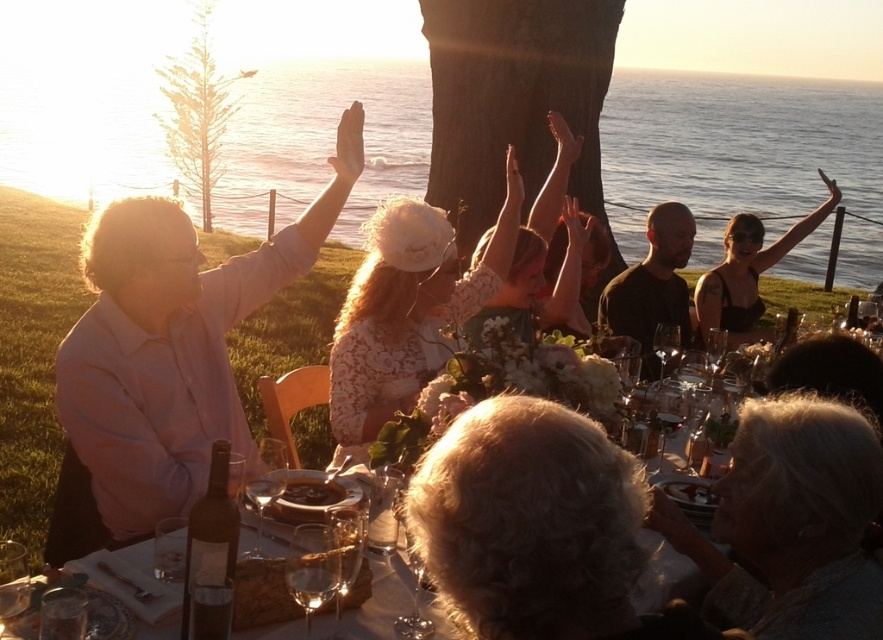
Find the location of `white lace dress at center`. white lace dress at center is located at coordinates (406, 310).

Which is in front, point (357, 380) or point (731, 316)?

Point (357, 380) is in front.

This screenshot has width=883, height=640. I want to click on white lace dress at center, so click(406, 310).

Can you confirm if green leafy tree at upper left is positioned below dark brown wooden plate at center?

Actually, green leafy tree at upper left is above dark brown wooden plate at center.

Can you confirm if green leafy tree at upper left is thinner than dark brown wooden plate at center?

In fact, green leafy tree at upper left might be wider than dark brown wooden plate at center.

Image resolution: width=883 pixels, height=640 pixels. What do you see at coordinates (197, 108) in the screenshot? I see `green leafy tree at upper left` at bounding box center [197, 108].

Where is `green leafy tree at upper left`? The image size is (883, 640). green leafy tree at upper left is located at coordinates coord(197,108).

Does white lace dress at center lie in front of dark brown wooden plate at center?

No.

Which is in front, point (344, 307) or point (334, 486)?

Positioned in front is point (334, 486).

The image size is (883, 640). Identify the location of white lace dress at center. [406, 310].